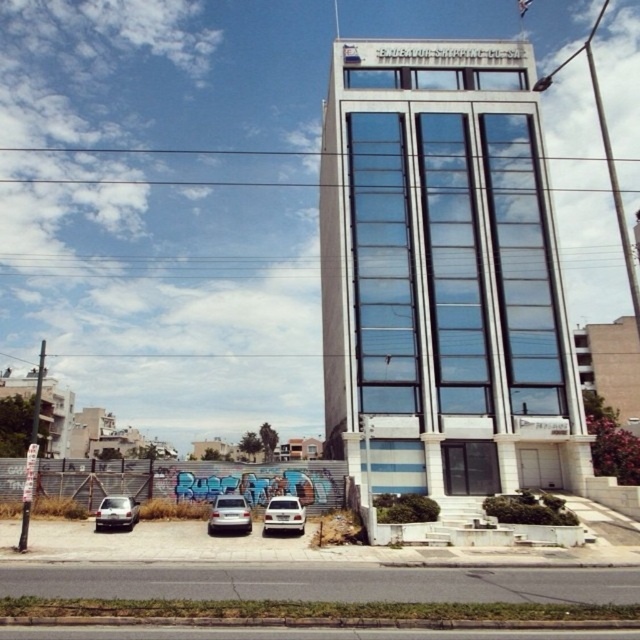
Can you confirm if transparent glass building at center is wider than satin silver car at lower center?

Correct, the width of transparent glass building at center exceeds that of satin silver car at lower center.

Does transparent glass building at center come behind satin silver car at lower center?

Yes, transparent glass building at center is behind satin silver car at lower center.

Is point (556, 314) positioned before point (216, 499)?

That is False.

Where is `transparent glass building at center`? The width and height of the screenshot is (640, 640). transparent glass building at center is located at coordinates (444, 275).

Does satin silver suv at lower center appear on the right side of satin silver sedan at lower left?

Correct, you'll find satin silver suv at lower center to the right of satin silver sedan at lower left.

Is satin silver suv at lower center above satin silver sedan at lower left?

Yes.

Which is behind, point (288, 499) or point (131, 513)?

The point (288, 499) is behind.

Identify the location of satin silver suv at lower center. The image size is (640, 640). (284, 515).

Who is shorter, satin silver car at lower center or satin silver sedan at lower left?

Standing shorter between the two is satin silver car at lower center.

Who is lower down, satin silver car at lower center or satin silver sedan at lower left?

Positioned lower is satin silver car at lower center.

Does point (227, 496) come farther from viewer compared to point (131, 506)?

That is True.

I want to click on satin silver car at lower center, so click(228, 515).